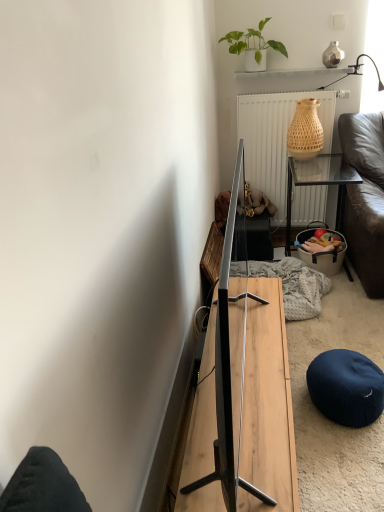
Identify the location of vacant area that is in front of dark blue fabric stool at lower right. The image size is (384, 512). (345, 456).